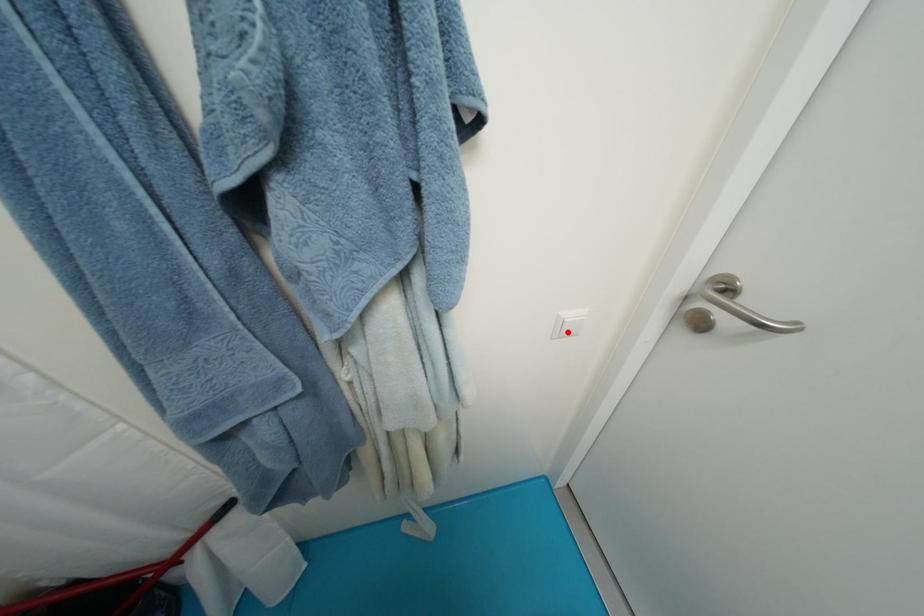
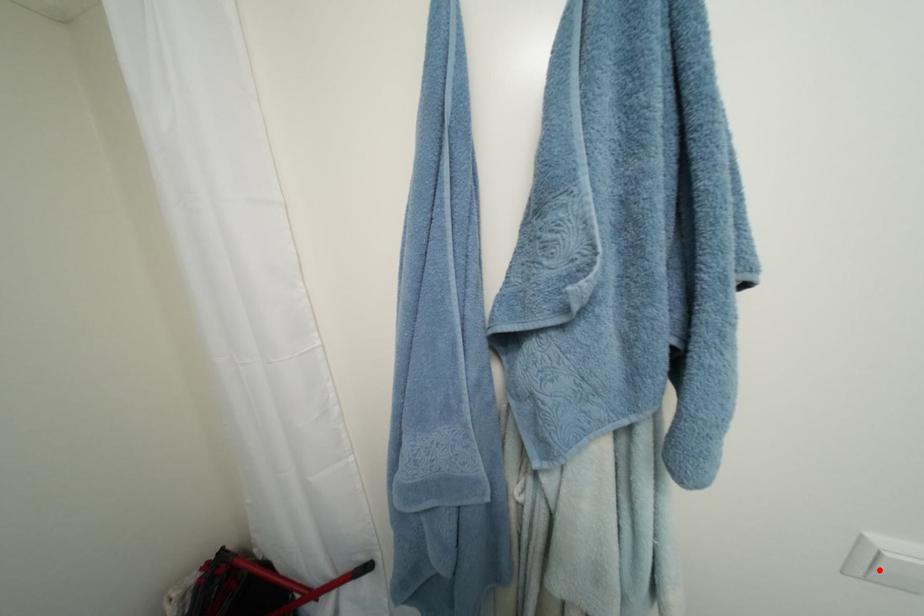
I am providing you with two images of the same scene from different viewpoints. A red point is marked on the first image and another point is marked on the second image. Is the marked point in image1 the same physical position as the marked point in image2?

Yes